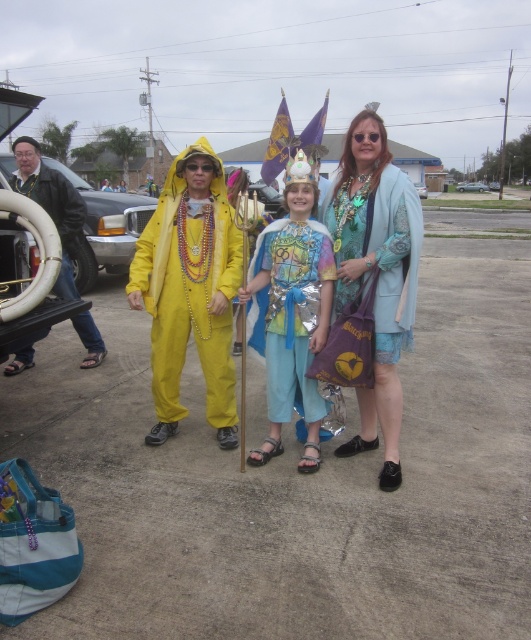
You are a photographer at the event and want to capture a photo of the teal fabric dress at center and the metallic silver car at left. From your current position, which object is closer to you?

The teal fabric dress at center is closer to you because it is in front of the metallic silver car at left.

You are a photographer trying to capture the teal fabric dress at center and the metallic silver car at left in the same frame. Based on their positions, which object is closer to the right edge of the photo?

The teal fabric dress at center is positioned on the right side of the metallic silver car at left, so the teal fabric dress at center is closer to the right edge of the photo.

You are a photographer trying to capture a photo of the teal fabric dress at center and the metallic silver car at left. Based on the scene description, which object is positioned lower in the frame?

The teal fabric dress at center is positioned lower in the frame than the metallic silver car at left.